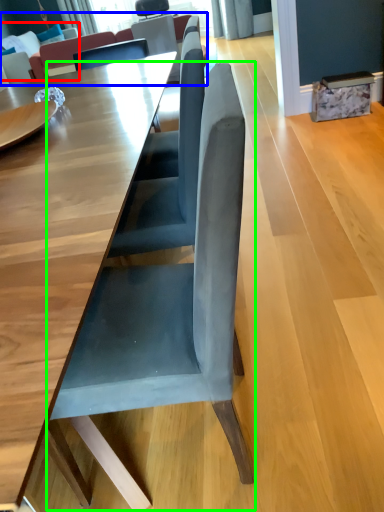
Question: Which object is positioned closest to couch (highlighted by a red box)? Select from couch (highlighted by a blue box) and chair (highlighted by a green box).

Choices:
 (A) couch
 (B) chair

Answer: (A)